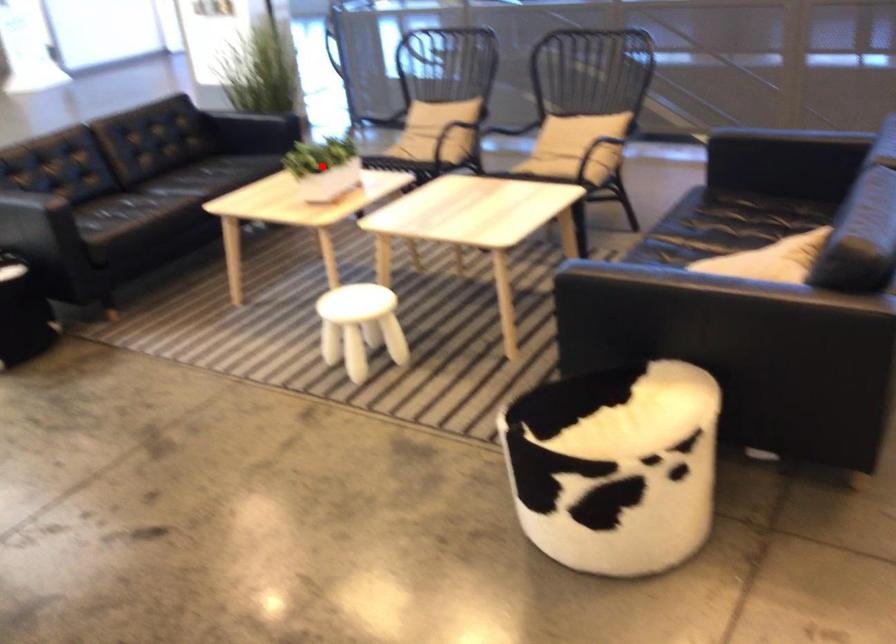
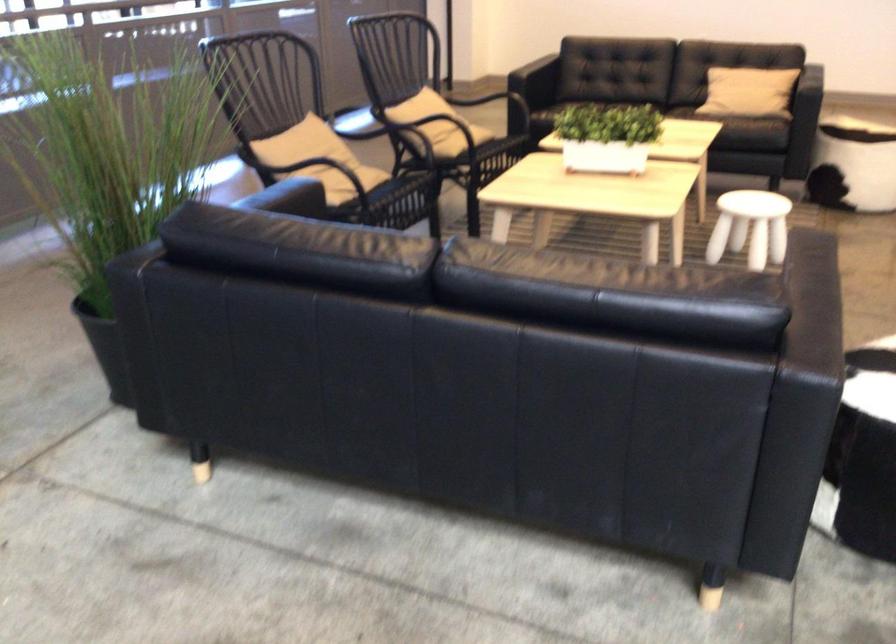
Question: A red point is marked in image1. In image2, is the corresponding 3D point closer to the camera or farther? Reply with the corresponding letter.

Choices:
 (A) The corresponding 3D point is closer.
 (B) The corresponding 3D point is farther.

Answer: (A)